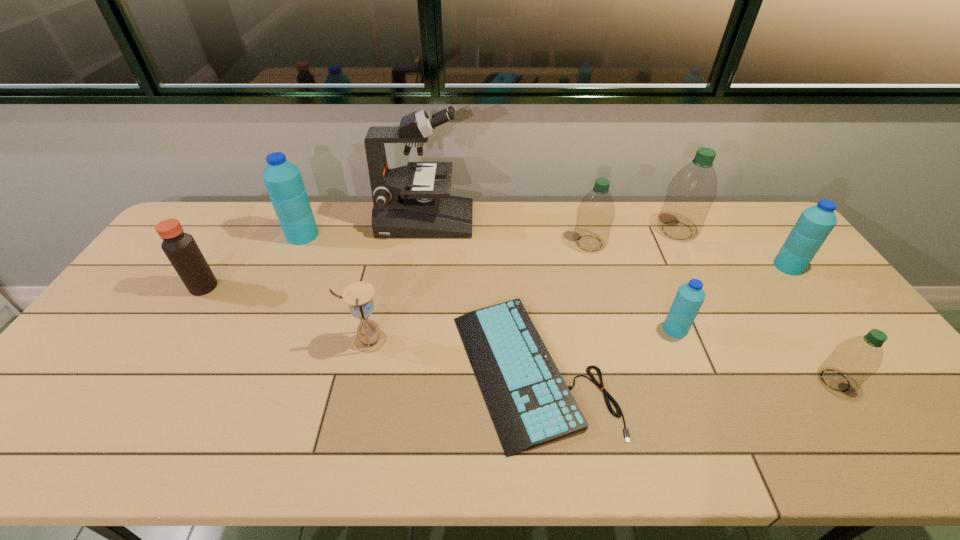
The image size is (960, 540). What are the coordinates of `brown vinegar` in the screenshot? It's located at (181, 249).

Where is `hourglass`? The width and height of the screenshot is (960, 540). hourglass is located at coordinates (370, 339).

Locate an element on the screen. The width and height of the screenshot is (960, 540). the nearest water bottle is located at coordinates (853, 361).

This screenshot has width=960, height=540. Find the location of `the nearest green water bottle`. the nearest green water bottle is located at coordinates (853, 361).

Identify the location of the second blue water bottle from left to right. The height and width of the screenshot is (540, 960). (689, 298).

The image size is (960, 540). I want to click on the seventh object from left to right, so click(x=689, y=298).

Image resolution: width=960 pixels, height=540 pixels. In order to click on computer keyboard in this screenshot , I will do `click(530, 404)`.

You are a GUI agent. You are given a task and a screenshot of the screen. Output one action in this format:
    pyautogui.click(x=<x>, y=<y>)
    Task: Click on the black computer keyboard
    This screenshot has width=960, height=540.
    Given the screenshot: What is the action you would take?
    point(530,404)

Where is `free space located 0.380m through the eyepieces of the tallest object`? free space located 0.380m through the eyepieces of the tallest object is located at coordinates (579, 221).

Find the location of a particular element. blank space located 0.200m on the front of the eighth object from left to right is located at coordinates (707, 286).